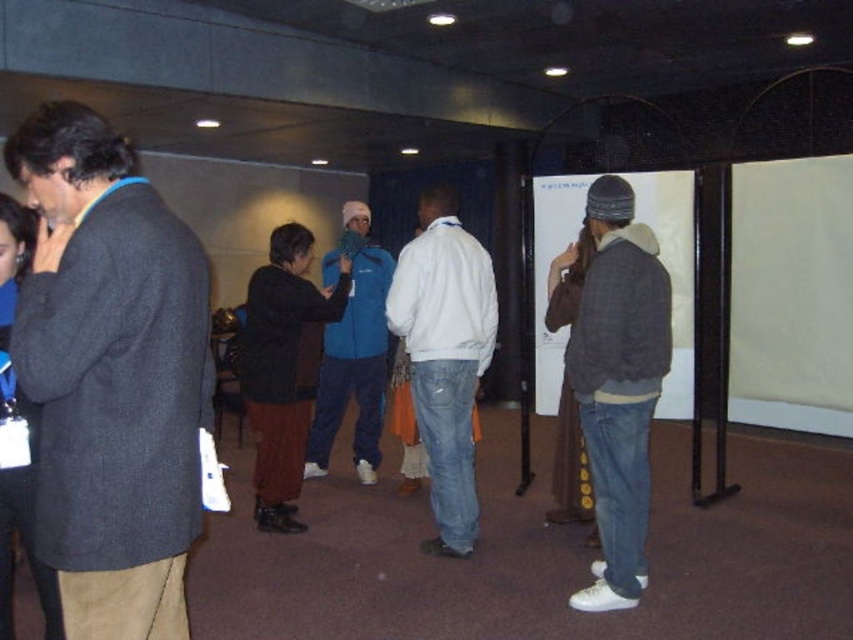
Is point (451, 376) closer to camera compared to point (548, 221)?

That is True.

Does white matte jacket at center appear on the right side of white matte projection screen at center?

No, white matte jacket at center is not to the right of white matte projection screen at center.

Where is `white matte jacket at center`? This screenshot has height=640, width=853. white matte jacket at center is located at coordinates (445, 355).

Does white matte projection screen at center appear on the left side of blue fleece jacket at center?

Incorrect, white matte projection screen at center is not on the left side of blue fleece jacket at center.

Based on the photo, can you confirm if white matte projection screen at center is positioned below blue fleece jacket at center?

No, white matte projection screen at center is not below blue fleece jacket at center.

Is point (550, 205) positioned in front of point (329, 410)?

Yes, it is.

Where is `white matte projection screen at center`? white matte projection screen at center is located at coordinates (672, 273).

The height and width of the screenshot is (640, 853). Describe the element at coordinates (618, 385) in the screenshot. I see `dark gray knit hat at center` at that location.

Does dark gray knit hat at center have a greater width compared to white matte jacket at center?

In fact, dark gray knit hat at center might be narrower than white matte jacket at center.

What do you see at coordinates (618, 385) in the screenshot? Image resolution: width=853 pixels, height=640 pixels. I see `dark gray knit hat at center` at bounding box center [618, 385].

Locate an element on the screen. Image resolution: width=853 pixels, height=640 pixels. dark gray knit hat at center is located at coordinates (618, 385).